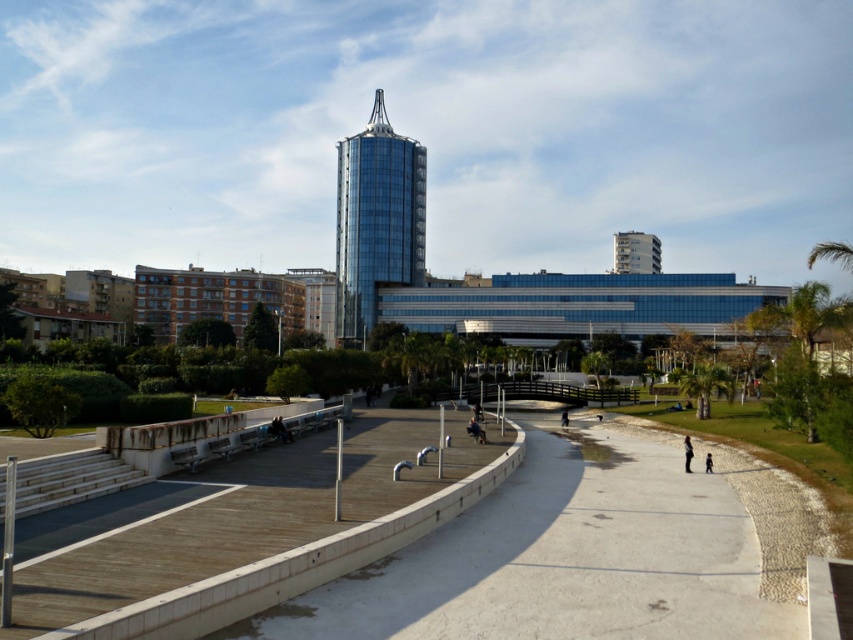
Which is behind, point (256, 481) or point (338, 246)?

Positioned behind is point (338, 246).

Locate an element on the screen. Image resolution: width=853 pixels, height=640 pixels. smooth concrete path at center is located at coordinates (258, 525).

Is glossy glass tower at center shorter than blurred fabric person at lower right?

In fact, glossy glass tower at center may be taller than blurred fabric person at lower right.

Who is more distant from viewer, (405, 196) or (683, 449)?

The point (405, 196) is behind.

The image size is (853, 640). I want to click on glossy glass tower at center, so click(x=376, y=220).

Can you confirm if concrete at center is positioned above dark gray fabric jacket at lower right?

Yes, concrete at center is above dark gray fabric jacket at lower right.

Is concrete at center below dark gray fabric jacket at lower right?

No, concrete at center is not below dark gray fabric jacket at lower right.

Between point (798, 616) and point (711, 470), which one is positioned in front?

Positioned in front is point (798, 616).

The width and height of the screenshot is (853, 640). Identify the location of concrete at center. (564, 557).